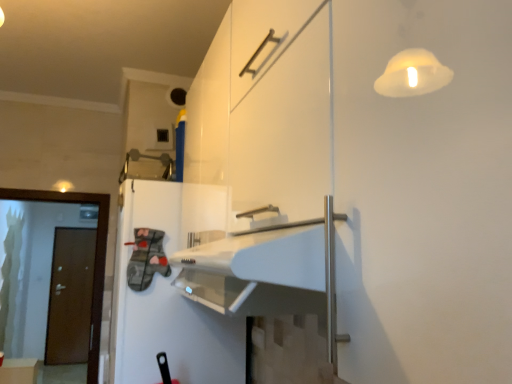
Question: Can you confirm if white glossy refrigerator at center is bigger than brown matte door at left?

Choices:
 (A) no
 (B) yes

Answer: (B)

Question: From a real-world perspective, is white glossy refrigerator at center on brown matte door at left?

Choices:
 (A) yes
 (B) no

Answer: (A)

Question: Is white glossy refrigerator at center turned away from brown matte door at left?

Choices:
 (A) yes
 (B) no

Answer: (B)

Question: Is white glossy refrigerator at center behind brown matte door at left?

Choices:
 (A) no
 (B) yes

Answer: (A)

Question: From the image's perspective, is white glossy refrigerator at center below brown matte door at left?

Choices:
 (A) yes
 (B) no

Answer: (B)

Question: Is white glossy refrigerator at center shorter than brown matte door at left?

Choices:
 (A) no
 (B) yes

Answer: (B)

Question: From a real-world perspective, is matte white cabinet at lower left physically below brown matte door at left?

Choices:
 (A) yes
 (B) no

Answer: (A)

Question: From the image's perspective, would you say matte white cabinet at lower left is positioned over brown matte door at left?

Choices:
 (A) no
 (B) yes

Answer: (A)

Question: From the image's perspective, does matte white cabinet at lower left appear lower than brown matte door at left?

Choices:
 (A) yes
 (B) no

Answer: (A)

Question: Are matte white cabinet at lower left and brown matte door at left located far from each other?

Choices:
 (A) yes
 (B) no

Answer: (A)

Question: Can you confirm if matte white cabinet at lower left is bigger than brown matte door at left?

Choices:
 (A) yes
 (B) no

Answer: (B)

Question: Can you confirm if matte white cabinet at lower left is taller than brown matte door at left?

Choices:
 (A) yes
 (B) no

Answer: (B)

Question: Considering the relative positions of brown matte door at left and white glossy refrigerator at center in the image provided, is brown matte door at left behind white glossy refrigerator at center?

Choices:
 (A) no
 (B) yes

Answer: (B)